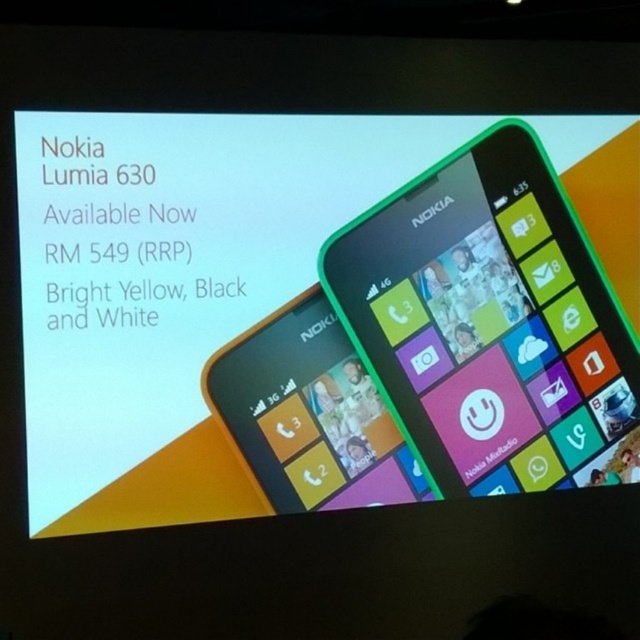
Is bright yellow plastic nokia lumia 630 at upper right smaller than green plastic nokia lumia 630 at right?

Incorrect, bright yellow plastic nokia lumia 630 at upper right is not smaller in size than green plastic nokia lumia 630 at right.

Can you confirm if bright yellow plastic nokia lumia 630 at upper right is positioned above green plastic nokia lumia 630 at right?

Yes, bright yellow plastic nokia lumia 630 at upper right is above green plastic nokia lumia 630 at right.

This screenshot has width=640, height=640. I want to click on bright yellow plastic nokia lumia 630 at upper right, so click(x=172, y=285).